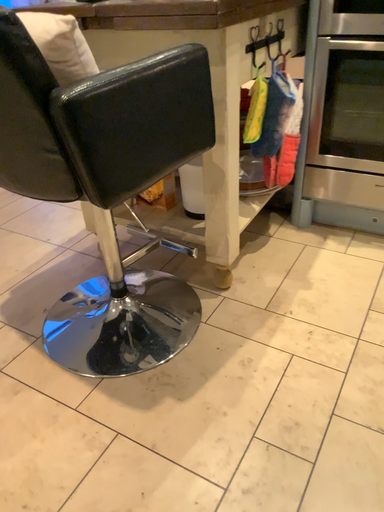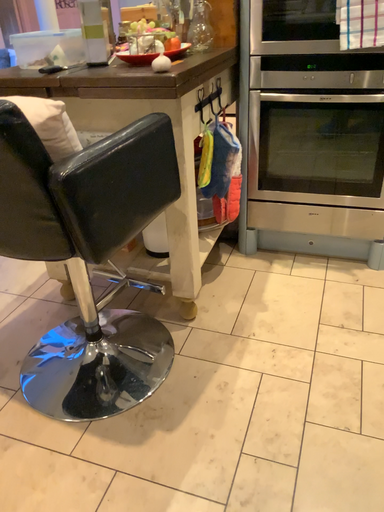
Question: How did the camera likely rotate when shooting the video?

Choices:
 (A) rotated right
 (B) rotated left

Answer: (A)